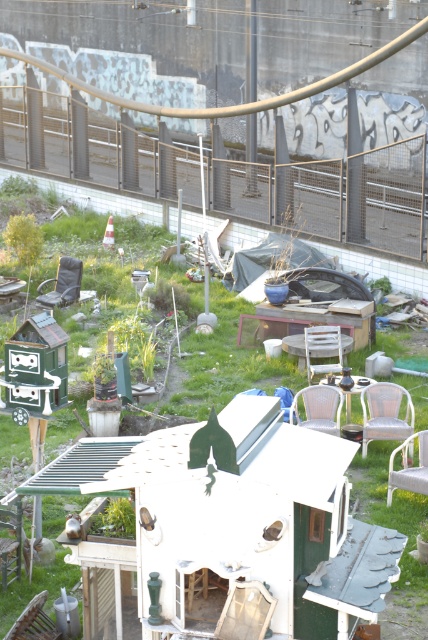
Is white plastic chair at lower right to the right of white plastic chair at center from the viewer's perspective?

Correct, you'll find white plastic chair at lower right to the right of white plastic chair at center.

Does white plastic chair at lower right have a lesser width compared to white plastic chair at center?

Yes.

The image size is (428, 640). I want to click on white plastic chair at lower right, so click(409, 467).

Can you confirm if matte black chair at center is positioned to the left of white plastic chair at center?

Correct, you'll find matte black chair at center to the left of white plastic chair at center.

Is matte black chair at center positioned at the back of white plastic chair at center?

Yes, matte black chair at center is behind white plastic chair at center.

Which is in front, point (65, 266) or point (311, 378)?

Point (311, 378) is in front.

Where is `matte black chair at center`? This screenshot has height=640, width=428. matte black chair at center is located at coordinates (62, 284).

Image resolution: width=428 pixels, height=640 pixels. What do you see at coordinates (385, 413) in the screenshot?
I see `metallic mesh chair at center-right` at bounding box center [385, 413].

Is point (400, 385) positioned behind point (323, 326)?

No, it is not.

Where is `metallic mesh chair at center-right`? This screenshot has width=428, height=640. metallic mesh chair at center-right is located at coordinates (385, 413).